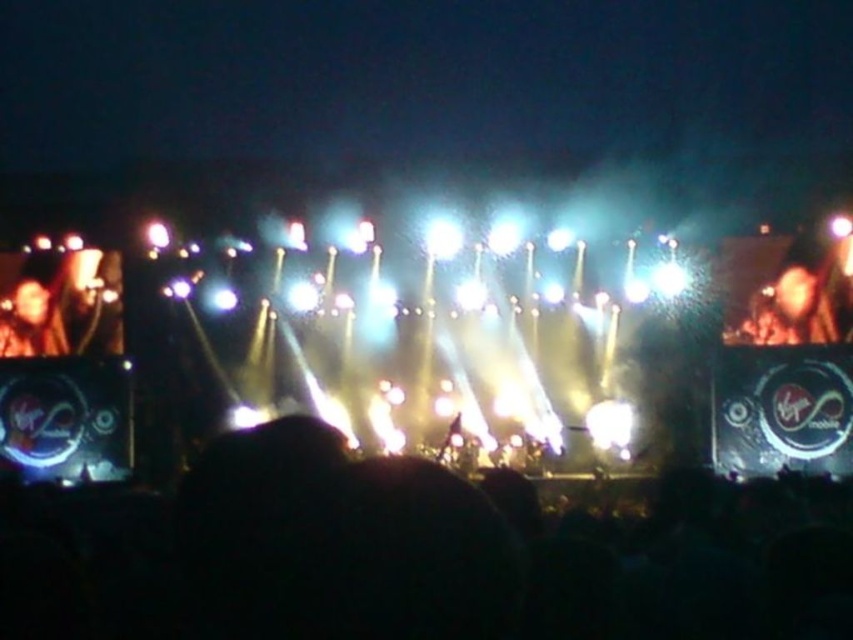
You are a photographer at the concert. You want to capture a photo that includes both the black matte crowd at lower center and the smooth skin face at left. Which object should you zoom in on to ensure both are clearly visible in the frame?

To ensure both the black matte crowd at lower center and the smooth skin face at left are clearly visible, you should zoom in on the black matte crowd at lower center since it is larger than the smooth skin face at left, allowing both to fit within the frame.

You are a photographer trying to capture a clear shot of the dark brown leather jacket at upper right without the black matte crowd at lower center blocking it. Based on the scene, where should you position yourself relative to the jacket?

The black matte crowd at lower center is in front of the dark brown leather jacket at upper right, so to avoid the crowd blocking the jacket, you should position yourself behind the dark brown leather jacket at upper right.

You are standing at the center of the concert venue and want to locate the dark brown leather jacket at upper right. According to the coordinates, where should you look relative to the stage?

The dark brown leather jacket at upper right is located at coordinates point (796, 294), which is to the upper right relative to the stage.